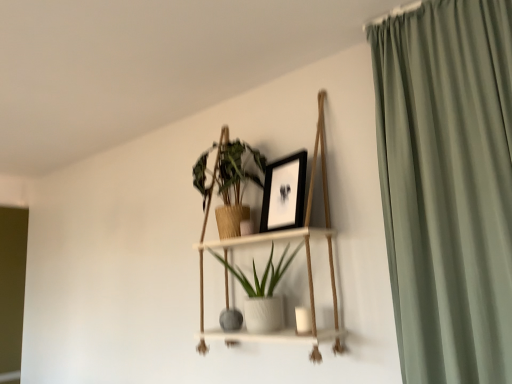
Question: From the image's perspective, is white wood shelf at center located above matte gray vase at center?

Choices:
 (A) no
 (B) yes

Answer: (B)

Question: Is white wood shelf at center directly adjacent to matte gray vase at center?

Choices:
 (A) yes
 (B) no

Answer: (B)

Question: Is white wood shelf at center far from matte gray vase at center?

Choices:
 (A) yes
 (B) no

Answer: (B)

Question: Is white wood shelf at center facing away from matte gray vase at center?

Choices:
 (A) no
 (B) yes

Answer: (B)

Question: Can you confirm if white wood shelf at center is positioned to the left of matte gray vase at center?

Choices:
 (A) yes
 (B) no

Answer: (B)

Question: Is point (218, 183) closer or farther from the camera than point (224, 266)?

Choices:
 (A) farther
 (B) closer

Answer: (B)

Question: Would you say green matte plant at upper center, the second houseplant ordered from the bottom, is to the left or to the right of white textured pot at center, acting as the second houseplant starting from the top, in the picture?

Choices:
 (A) right
 (B) left

Answer: (B)

Question: Relative to white textured pot at center, placed as the 1th houseplant when sorted from bottom to top, is green matte plant at upper center, which appears as the 1th houseplant when viewed from the top, in front or behind?

Choices:
 (A) front
 (B) behind

Answer: (B)

Question: Is green matte plant at upper center, which appears as the 1th houseplant when viewed from the top, taller or shorter than white textured pot at center, acting as the second houseplant starting from the top?

Choices:
 (A) short
 (B) tall

Answer: (B)

Question: In the image, is white wood shelf at center positioned in front of or behind matte gray vase at center?

Choices:
 (A) front
 (B) behind

Answer: (A)

Question: Based on their positions, is white wood shelf at center located to the left or right of matte gray vase at center?

Choices:
 (A) left
 (B) right

Answer: (B)

Question: From a real-world perspective, is white wood shelf at center positioned above or below matte gray vase at center?

Choices:
 (A) below
 (B) above

Answer: (B)

Question: Is white wood shelf at center spatially inside matte gray vase at center, or outside of it?

Choices:
 (A) outside
 (B) inside

Answer: (A)

Question: In the image, is matte gray vase at center positioned in front of or behind black matte picture frame at upper center?

Choices:
 (A) front
 (B) behind

Answer: (B)

Question: In terms of size, does matte gray vase at center appear bigger or smaller than black matte picture frame at upper center?

Choices:
 (A) big
 (B) small

Answer: (B)